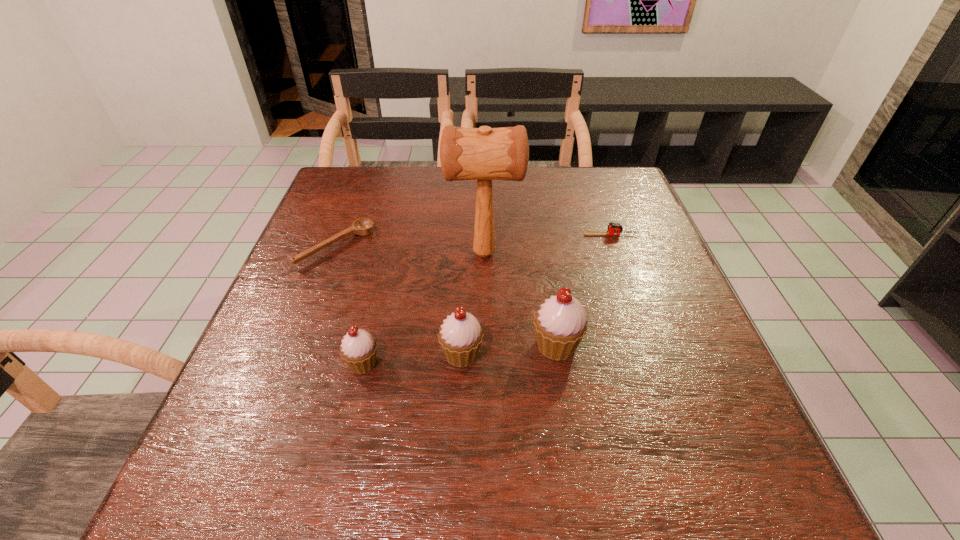
Image resolution: width=960 pixels, height=540 pixels. In order to click on the third closest cupcake to the mallet in this screenshot , I will do `click(358, 349)`.

Where is `vacant space that satisfies the following two spatial constraints: 1. on the back side of the third shortest object; 2. on the left side of the fourth shortest object`? vacant space that satisfies the following two spatial constraints: 1. on the back side of the third shortest object; 2. on the left side of the fourth shortest object is located at coordinates (365, 354).

Image resolution: width=960 pixels, height=540 pixels. Identify the location of vacant space that satisfies the following two spatial constraints: 1. on the strike surface of the mallet; 2. on the right side of the tallest cupcake. pyautogui.click(x=485, y=346).

Find the location of a particular element. Image resolution: width=960 pixels, height=540 pixels. vacant region that satisfies the following two spatial constraints: 1. on the strike surface of the tallest cupcake; 2. on the left side of the tallest object is located at coordinates (485, 346).